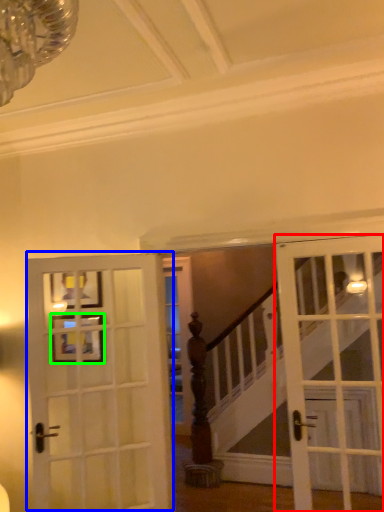
Question: Considering the real-world distances, which object is closest to door (highlighted by a red box)? door (highlighted by a blue box) or picture frame (highlighted by a green box).

Choices:
 (A) door
 (B) picture frame

Answer: (A)